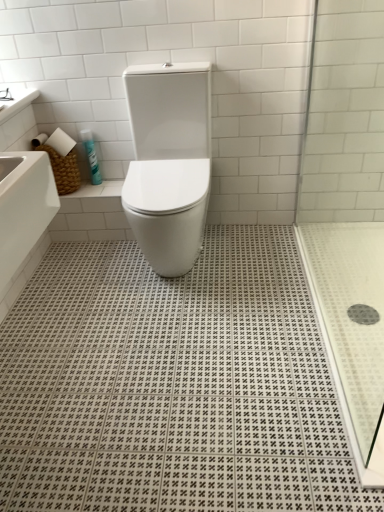
Where is `black rubber drain at lower right`? black rubber drain at lower right is located at coordinates (363, 314).

This screenshot has height=512, width=384. What do you see at coordinates (91, 156) in the screenshot?
I see `blue glossy spray can at upper left` at bounding box center [91, 156].

Measure the distance between point (21, 89) and camera.

Point (21, 89) is 1.98 meters from camera.

I want to click on transparent glass shower door at right, so click(347, 207).

From a real-world perspective, which object rests below the other?

blue glossy spray can at upper left is physically lower.

Is blue glossy spray can at upper left completely or partially outside of white glossy toilet at center?

Yes.

Is blue glossy spray can at upper left looking in the opposite direction of white glossy toilet at center?

No, blue glossy spray can at upper left's orientation is not away from white glossy toilet at center.

Considering the sizes of objects blue glossy spray can at upper left and white glossy toilet at center in the image provided, who is smaller, blue glossy spray can at upper left or white glossy toilet at center?

With smaller size is blue glossy spray can at upper left.

Does transparent glass shower door at right appear on the right side of white glossy countertop at upper left?

Yes.

From a real-world perspective, which is physically below, transparent glass shower door at right or white glossy countertop at upper left?

transparent glass shower door at right is physically lower.

Is transparent glass shower door at right taller or shorter than white glossy countertop at upper left?

In the image, transparent glass shower door at right appears to be taller than white glossy countertop at upper left.

Measure the distance between black rubber drain at lower right and transparent glass shower door at right.

black rubber drain at lower right and transparent glass shower door at right are 84.18 centimeters apart.

In the image, there is a transparent glass shower door at right. Identify the location of drain below it (from the image's perspective). Image resolution: width=384 pixels, height=512 pixels. (363, 314).

Is black rubber drain at lower right to the left of transparent glass shower door at right from the viewer's perspective?

In fact, black rubber drain at lower right is to the right of transparent glass shower door at right.

Is black rubber drain at lower right thinner than transparent glass shower door at right?

Yes, black rubber drain at lower right is thinner than transparent glass shower door at right.

Is white glossy toilet at center inside the boundaries of white glossy countertop at upper left, or outside?

white glossy toilet at center cannot be found inside white glossy countertop at upper left.

Is white glossy toilet at center facing away from white glossy countertop at upper left?

No.

Is white glossy toilet at center wider than white glossy countertop at upper left?

Yes, white glossy toilet at center is wider than white glossy countertop at upper left.

From the image's perspective, which one is positioned lower, white glossy toilet at center or white glossy countertop at upper left?

white glossy toilet at center.

Is white glossy toilet at center facing away from black rubber drain at lower right?

No.

Do you think white glossy toilet at center is within black rubber drain at lower right, or outside of it?

white glossy toilet at center exists outside the volume of black rubber drain at lower right.

Can you confirm if white glossy toilet at center is positioned to the left of black rubber drain at lower right?

Yes, white glossy toilet at center is to the left of black rubber drain at lower right.

Can you tell me how much white glossy toilet at center and black rubber drain at lower right differ in facing direction?

The angular difference between white glossy toilet at center and black rubber drain at lower right is 85.4 degrees.

Is transparent glass shower door at right taller or shorter than blue glossy spray can at upper left?

Considering their sizes, transparent glass shower door at right has more height than blue glossy spray can at upper left.

Based on their positions, is transparent glass shower door at right located to the left or right of blue glossy spray can at upper left?

In the image, transparent glass shower door at right appears on the right side of blue glossy spray can at upper left.

Can you confirm if transparent glass shower door at right is smaller than blue glossy spray can at upper left?

Incorrect, transparent glass shower door at right is not smaller in size than blue glossy spray can at upper left.

Is point (331, 354) in front of point (91, 164)?

Yes, point (331, 354) is closer to viewer.

Is blue glossy spray can at upper left oriented away from black rubber drain at lower right?

No, blue glossy spray can at upper left's orientation is not away from black rubber drain at lower right.

Is blue glossy spray can at upper left closer to camera compared to black rubber drain at lower right?

No, blue glossy spray can at upper left is further to the viewer.

Based on their sizes in the image, would you say blue glossy spray can at upper left is bigger or smaller than black rubber drain at lower right?

Considering their sizes, blue glossy spray can at upper left takes up more space than black rubber drain at lower right.

Image resolution: width=384 pixels, height=512 pixels. In order to click on toilet in front of the blue glossy spray can at upper left in this screenshot , I will do `click(169, 162)`.

Locate an element on the screen. The image size is (384, 512). shower door on the right side of white glossy countertop at upper left is located at coordinates (347, 207).

Estimate the real-world distances between objects in this image. Which object is closer to black rubber drain at lower right, white glossy toilet at center or blue glossy spray can at upper left?

white glossy toilet at center lies closer to black rubber drain at lower right than the other object.

Looking at the image, which one is located closer to white glossy toilet at center, black rubber drain at lower right or blue glossy spray can at upper left?

blue glossy spray can at upper left is closer to white glossy toilet at center.

Based on their spatial positions, is black rubber drain at lower right or white glossy toilet at center further from transparent glass shower door at right?

black rubber drain at lower right is further to transparent glass shower door at right.

When comparing their distances from white glossy toilet at center, does white glossy countertop at upper left or black rubber drain at lower right seem closer?

Based on the image, white glossy countertop at upper left appears to be nearer to white glossy toilet at center.

Considering their positions, is blue glossy spray can at upper left positioned closer to white glossy toilet at center than white glossy countertop at upper left?

blue glossy spray can at upper left.

In the scene shown: Estimate the real-world distances between objects in this image. Which object is further from white glossy toilet at center, black rubber drain at lower right or transparent glass shower door at right?

The object further to white glossy toilet at center is black rubber drain at lower right.

From the image, which object appears to be nearer to transparent glass shower door at right, black rubber drain at lower right or white glossy countertop at upper left?

Among the two, black rubber drain at lower right is located nearer to transparent glass shower door at right.

Which object lies nearer to the anchor point transparent glass shower door at right, white glossy countertop at upper left or black rubber drain at lower right?

black rubber drain at lower right.

You are a GUI agent. You are given a task and a screenshot of the screen. Output one action in this format:
    pyautogui.click(x=<x>, y=<y>)
    Task: Click on the counter top between transparent glass shower door at right and blue glossy spray can at upper left along the z-axis
    The height and width of the screenshot is (512, 384).
    Given the screenshot: What is the action you would take?
    pyautogui.click(x=17, y=101)

Identify the location of shower door situated between white glossy countertop at upper left and black rubber drain at lower right from left to right. This screenshot has height=512, width=384. (347, 207).

Where is `toiletry between white glossy countertop at upper left and black rubber drain at lower right`? The height and width of the screenshot is (512, 384). toiletry between white glossy countertop at upper left and black rubber drain at lower right is located at coordinates (91, 156).

Find the location of a particular element. Image resolution: width=384 pixels, height=512 pixels. toilet between blue glossy spray can at upper left and black rubber drain at lower right in the horizontal direction is located at coordinates (169, 162).